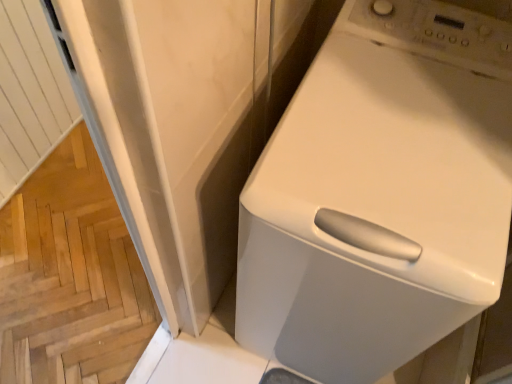
Locate an element on the screen. This screenshot has height=384, width=512. empty space that is ontop of wooden parquet floor at lower left is located at coordinates (68, 256).